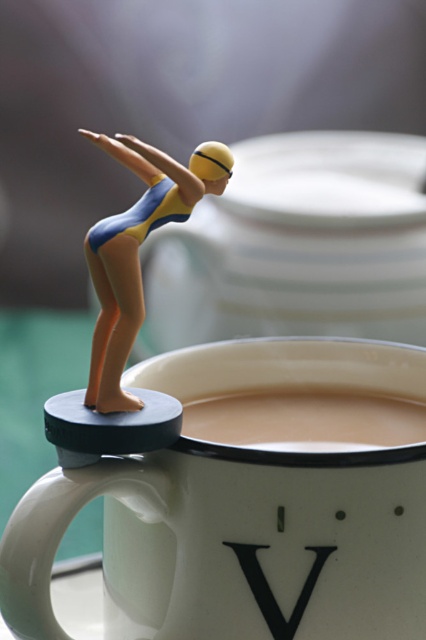
Does white ceramic mug at upper center have a smaller size compared to matte plastic diver at upper left?

Incorrect, white ceramic mug at upper center is not smaller in size than matte plastic diver at upper left.

Can you confirm if white ceramic mug at upper center is positioned to the right of matte plastic diver at upper left?

Indeed, white ceramic mug at upper center is positioned on the right side of matte plastic diver at upper left.

Which is in front, point (63, 467) or point (195, 196)?

Positioned in front is point (63, 467).

This screenshot has height=640, width=426. What are the coordinates of `white ceramic mug at upper center` in the screenshot? It's located at (250, 500).

Between point (129, 234) and point (238, 544), which one is positioned in front?

Point (129, 234)

Is matte plastic diver at upper left above black matte letter v at upper center?

Yes.

Which is behind, point (141, 141) or point (307, 573)?

The point (307, 573) is more distant.

At what (x,y) coordinates should I click in order to perform the action: click on matte plastic diver at upper left. Please return your answer as a coordinate pair (x, y). The width and height of the screenshot is (426, 640). Looking at the image, I should click on (131, 259).

Between point (129, 612) and point (282, 412), which one is positioned in front?

Point (129, 612) is more forward.

Where is `white ceramic mug at upper center`? white ceramic mug at upper center is located at coordinates (250, 500).